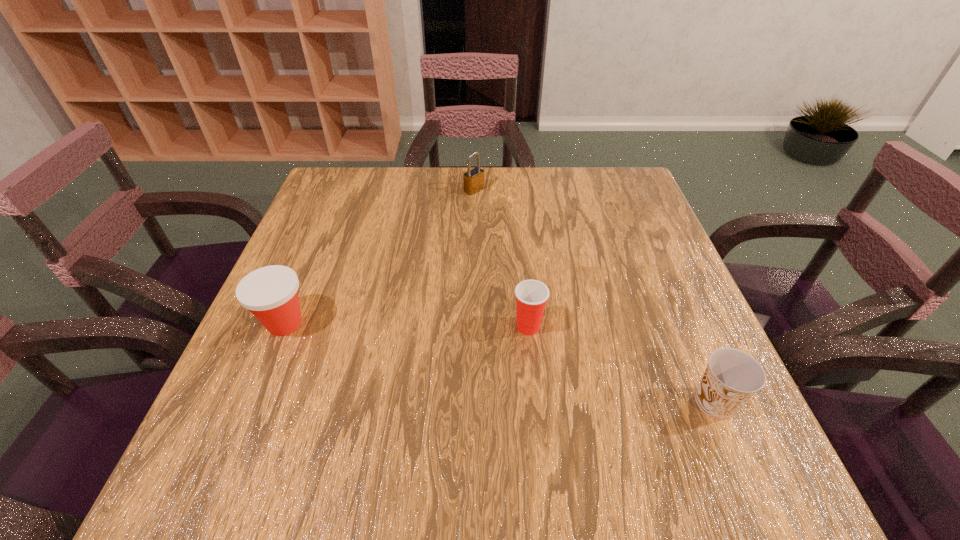
The width and height of the screenshot is (960, 540). What are the coordinates of `the third object from right to left` in the screenshot? It's located at (473, 180).

Locate an element on the screen. Image resolution: width=960 pixels, height=540 pixels. the farthest object is located at coordinates (473, 180).

The image size is (960, 540). Identify the location of the leftmost Dixie cup. (270, 293).

The image size is (960, 540). What are the coordinates of `the second Dixie cup from left to right` in the screenshot? It's located at (531, 296).

This screenshot has height=540, width=960. In order to click on the nearest Dixie cup in this screenshot , I will do coord(732,377).

Locate an element on the screen. Image resolution: width=960 pixels, height=540 pixels. the rightmost object is located at coordinates (732, 377).

I want to click on vacant space located on the right of the third object from right to left, so click(x=621, y=190).

Find the location of a particular element. This screenshot has height=540, width=960. free space located on the front of the leftmost object is located at coordinates (259, 386).

Locate an element on the screen. The width and height of the screenshot is (960, 540). vacant space positioned 0.250m on the back of the second Dixie cup from left to right is located at coordinates (519, 239).

This screenshot has width=960, height=540. Identify the location of vacant space situated on the front of the nearest object. (739, 461).